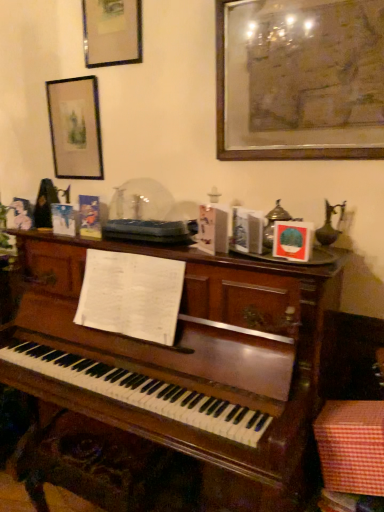
You are a GUI agent. You are given a task and a screenshot of the screen. Output one action in this format:
    pyautogui.click(x=<x>, y=<y>)
    Task: Click on the matte black picture frame at upper left, which ranks as the 2th picture frame in left-to-right order
    
    Given the screenshot: What is the action you would take?
    pyautogui.click(x=112, y=32)

Find the location of a particular element. matte black picture frame at upper left, placed as the 1th picture frame when sorted from back to front is located at coordinates (75, 128).

Identify the location of wooden framed artwork at upper right, the first picture frame viewed from the right. (300, 79).

At what (x,y) coordinates should I click in order to perform the action: click on checkered fabric box at lower right. Please return your answer as a coordinate pair (x, y). Looking at the image, I should click on (351, 449).

Can you confirm if checkered fabric box at lower right is wider than matte black picture frame at upper left, the first picture frame from the left?

Correct, the width of checkered fabric box at lower right exceeds that of matte black picture frame at upper left, the first picture frame from the left.

The image size is (384, 512). I want to click on table below the matte black picture frame at upper left, acting as the 3th picture frame starting from the right (from the image's perspective), so click(351, 449).

Is checkered fabric box at lower right facing towards matte black picture frame at upper left, acting as the 3th picture frame starting from the right?

No.

Measure the distance from checkered fabric box at lower right to matte black picture frame at upper left, placed as the 1th picture frame when sorted from back to front.

They are 1.65 meters apart.

Based on the photo, from the image's perspective, between checkered fabric box at lower right and matte black picture frame at upper left, which ranks as the 2th picture frame in left-to-right order, which one is located above?

matte black picture frame at upper left, which ranks as the 2th picture frame in left-to-right order, from the image's perspective.

Who is taller, checkered fabric box at lower right or matte black picture frame at upper left, arranged as the 2th picture frame when viewed from the right?

Standing taller between the two is matte black picture frame at upper left, arranged as the 2th picture frame when viewed from the right.

Is checkered fabric box at lower right looking in the opposite direction of matte black picture frame at upper left, arranged as the second picture frame when viewed from the back?

That's not correct — checkered fabric box at lower right is not looking away from matte black picture frame at upper left, arranged as the second picture frame when viewed from the back.

Considering the sizes of objects checkered fabric box at lower right and matte black picture frame at upper left, arranged as the second picture frame when viewed from the back, in the image provided, who is wider, checkered fabric box at lower right or matte black picture frame at upper left, arranged as the second picture frame when viewed from the back,?

checkered fabric box at lower right.

Can you see matte black picture frame at upper left, arranged as the 2th picture frame when viewed from the right, touching checkered fabric box at lower right?

No, matte black picture frame at upper left, arranged as the 2th picture frame when viewed from the right, is not beside checkered fabric box at lower right.

Which picture frame is the 2nd one when counting from the left side of the checkered fabric box at lower right? Please provide its 2D coordinates.

[(112, 32)]

Which is in front, point (104, 35) or point (326, 466)?

The point (326, 466) is closer.

Considering the sizes of objects matte black picture frame at upper left, which ranks as the 2th picture frame in left-to-right order, and checkered fabric box at lower right in the image provided, who is shorter, matte black picture frame at upper left, which ranks as the 2th picture frame in left-to-right order, or checkered fabric box at lower right?

checkered fabric box at lower right.

Does checkered fabric box at lower right have a larger size compared to wooden framed artwork at upper right, marked as the 3th picture frame in a left-to-right arrangement?

No.

Relative to wooden framed artwork at upper right, the 1th picture frame from the front, is checkered fabric box at lower right in front or behind?

In the image, checkered fabric box at lower right appears in front of wooden framed artwork at upper right, the 1th picture frame from the front.

Could you tell me if checkered fabric box at lower right is turned towards wooden framed artwork at upper right, the 1th picture frame from the front?

No, checkered fabric box at lower right does not turn towards wooden framed artwork at upper right, the 1th picture frame from the front.

Is checkered fabric box at lower right placed right next to wooden framed artwork at upper right, the first picture frame viewed from the right?

No, checkered fabric box at lower right is not with wooden framed artwork at upper right, the first picture frame viewed from the right.

From a real-world perspective, which object rests below the other?

In real-world perspective, matte black picture frame at upper left, the first picture frame from the left, is lower.

Would you say wooden framed artwork at upper right, the 1th picture frame from the front, is a long distance from matte black picture frame at upper left, placed as the 1th picture frame when sorted from back to front?

Actually, wooden framed artwork at upper right, the 1th picture frame from the front, and matte black picture frame at upper left, placed as the 1th picture frame when sorted from back to front, are a little close together.

Considering the positions of objects wooden framed artwork at upper right, the first picture frame viewed from the right, and matte black picture frame at upper left, acting as the 3th picture frame starting from the right, in the image provided, who is more to the right, wooden framed artwork at upper right, the first picture frame viewed from the right, or matte black picture frame at upper left, acting as the 3th picture frame starting from the right,?

wooden framed artwork at upper right, the first picture frame viewed from the right.

Is matte black picture frame at upper left, the first picture frame from the left, at the back of wooden framed artwork at upper right, the 1th picture frame from the front?

No, wooden framed artwork at upper right, the 1th picture frame from the front, is not facing away from matte black picture frame at upper left, the first picture frame from the left.

From a real-world perspective, is wooden framed artwork at upper right, the 1th picture frame from the front, physically below checkered fabric box at lower right?

No, from a real-world perspective, wooden framed artwork at upper right, the 1th picture frame from the front, is not under checkered fabric box at lower right.

Looking at this image, which object is positioned more to the left, wooden framed artwork at upper right, the 1th picture frame from the front, or checkered fabric box at lower right?

wooden framed artwork at upper right, the 1th picture frame from the front.

Which is behind, wooden framed artwork at upper right, the 1th picture frame from the front, or checkered fabric box at lower right?

Positioned behind is wooden framed artwork at upper right, the 1th picture frame from the front.

Considering the relative sizes of wooden framed artwork at upper right, the 1th picture frame from the front, and checkered fabric box at lower right in the image provided, is wooden framed artwork at upper right, the 1th picture frame from the front, shorter than checkered fabric box at lower right?

No, wooden framed artwork at upper right, the 1th picture frame from the front, is not shorter than checkered fabric box at lower right.

Considering the sizes of matte black picture frame at upper left, the first picture frame from the left, and checkered fabric box at lower right in the image, is matte black picture frame at upper left, the first picture frame from the left, wider or thinner than checkered fabric box at lower right?

matte black picture frame at upper left, the first picture frame from the left, is thinner than checkered fabric box at lower right.

Looking at this image, can you confirm if matte black picture frame at upper left, which appears as the 3th picture frame when viewed from the front, is positioned to the left of checkered fabric box at lower right?

Correct, you'll find matte black picture frame at upper left, which appears as the 3th picture frame when viewed from the front, to the left of checkered fabric box at lower right.

Could you tell me if matte black picture frame at upper left, the first picture frame from the left, is facing checkered fabric box at lower right?

No, matte black picture frame at upper left, the first picture frame from the left, does not turn towards checkered fabric box at lower right.

Considering the sizes of objects matte black picture frame at upper left, which appears as the 3th picture frame when viewed from the front, and checkered fabric box at lower right in the image provided, who is shorter, matte black picture frame at upper left, which appears as the 3th picture frame when viewed from the front, or checkered fabric box at lower right?

Standing shorter between the two is checkered fabric box at lower right.

Where is `table lying below the matte black picture frame at upper left, placed as the 1th picture frame when sorted from back to front (from the image's perspective)`? table lying below the matte black picture frame at upper left, placed as the 1th picture frame when sorted from back to front (from the image's perspective) is located at coordinates (351, 449).

You are a GUI agent. You are given a task and a screenshot of the screen. Output one action in this format:
    pyautogui.click(x=<x>, y=<y>)
    Task: Click on the table on the right side of matte black picture frame at upper left, arranged as the second picture frame when viewed from the back
    The width and height of the screenshot is (384, 512).
    Given the screenshot: What is the action you would take?
    pyautogui.click(x=351, y=449)

From the image, which object appears to be nearer to checkered fabric box at lower right, matte black picture frame at upper left, the first picture frame from the left, or matte black picture frame at upper left, which ranks as the 2th picture frame in left-to-right order?

matte black picture frame at upper left, the first picture frame from the left, is positioned closer to the anchor checkered fabric box at lower right.

Which object lies further to the anchor point wooden framed artwork at upper right, marked as the third picture frame in a back-to-front arrangement, matte black picture frame at upper left, arranged as the second picture frame when viewed from the back, or checkered fabric box at lower right?

checkered fabric box at lower right is positioned further to the anchor wooden framed artwork at upper right, marked as the third picture frame in a back-to-front arrangement.

Looking at this image, when comparing their distances from wooden framed artwork at upper right, marked as the third picture frame in a back-to-front arrangement, does checkered fabric box at lower right or matte black picture frame at upper left, placed as the 1th picture frame when sorted from back to front, seem further?

checkered fabric box at lower right is further to wooden framed artwork at upper right, marked as the third picture frame in a back-to-front arrangement.

Estimate the real-world distances between objects in this image. Which object is closer to matte black picture frame at upper left, arranged as the second picture frame when viewed from the back, matte black picture frame at upper left, placed as the 1th picture frame when sorted from back to front, or checkered fabric box at lower right?

matte black picture frame at upper left, placed as the 1th picture frame when sorted from back to front.

From the image, which object appears to be farther from matte black picture frame at upper left, the 2th picture frame when ordered from front to back, wooden framed artwork at upper right, marked as the third picture frame in a back-to-front arrangement, or checkered fabric box at lower right?

checkered fabric box at lower right is positioned further to the anchor matte black picture frame at upper left, the 2th picture frame when ordered from front to back.

When comparing their distances from wooden framed artwork at upper right, marked as the third picture frame in a back-to-front arrangement, does matte black picture frame at upper left, placed as the 1th picture frame when sorted from back to front, or matte black picture frame at upper left, arranged as the 2th picture frame when viewed from the right, seem closer?

matte black picture frame at upper left, arranged as the 2th picture frame when viewed from the right, lies closer to wooden framed artwork at upper right, marked as the third picture frame in a back-to-front arrangement, than the other object.

Considering their positions, is wooden framed artwork at upper right, marked as the third picture frame in a back-to-front arrangement, positioned further to matte black picture frame at upper left, the first picture frame from the left, than checkered fabric box at lower right?

checkered fabric box at lower right.

When comparing their distances from checkered fabric box at lower right, does matte black picture frame at upper left, arranged as the second picture frame when viewed from the back, or matte black picture frame at upper left, which appears as the 3th picture frame when viewed from the front, seem further?

Based on the image, matte black picture frame at upper left, arranged as the second picture frame when viewed from the back, appears to be further to checkered fabric box at lower right.

Where is `picture frame between matte black picture frame at upper left, placed as the 1th picture frame when sorted from back to front, and wooden framed artwork at upper right, the first picture frame viewed from the right, from left to right`? picture frame between matte black picture frame at upper left, placed as the 1th picture frame when sorted from back to front, and wooden framed artwork at upper right, the first picture frame viewed from the right, from left to right is located at coordinates (112, 32).

Locate an element on the screen. picture frame between wooden framed artwork at upper right, marked as the third picture frame in a back-to-front arrangement, and checkered fabric box at lower right vertically is located at coordinates (75, 128).